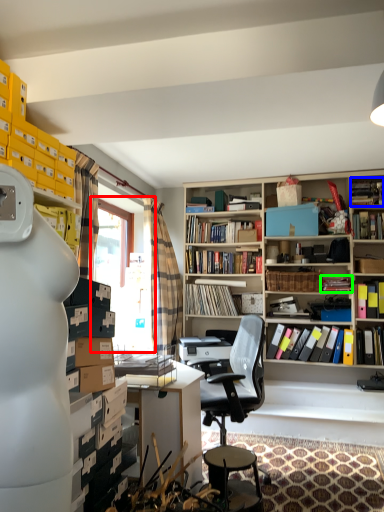
Question: Which object is positioned farthest from window screen (highlighted by a red box)? Select from book (highlighted by a blue box) and book (highlighted by a green box).

Choices:
 (A) book
 (B) book

Answer: (A)